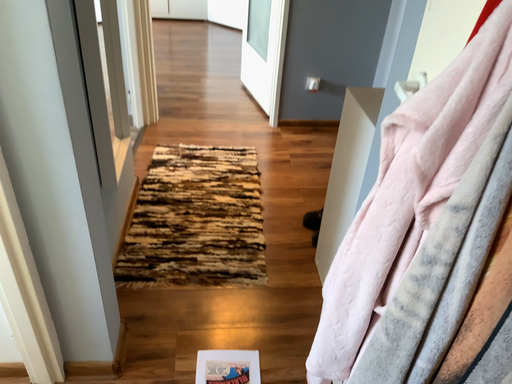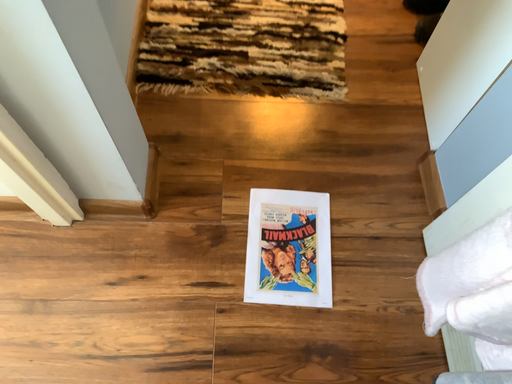
Question: How did the camera likely rotate when shooting the video?

Choices:
 (A) rotated upward
 (B) rotated downward

Answer: (B)